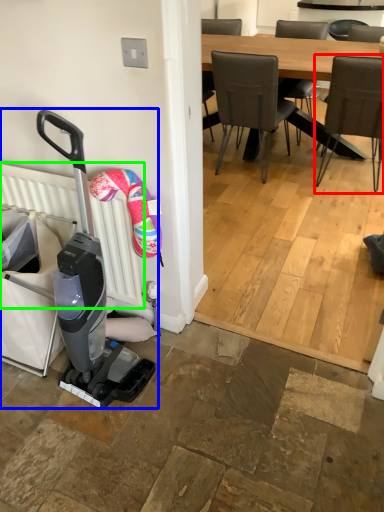
Question: Considering the real-world distances, which object is farthest from chair (highlighted by a red box)? baby carriage (highlighted by a blue box) or radiator (highlighted by a green box)?

Choices:
 (A) baby carriage
 (B) radiator

Answer: (A)